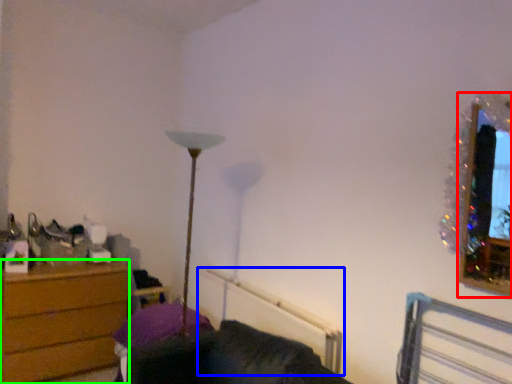
Question: Based on their relative distances, which object is farther from picture frame (highlighted by a red box)? Choose from radiator (highlighted by a blue box) and chest of drawers (highlighted by a green box).

Choices:
 (A) radiator
 (B) chest of drawers

Answer: (B)